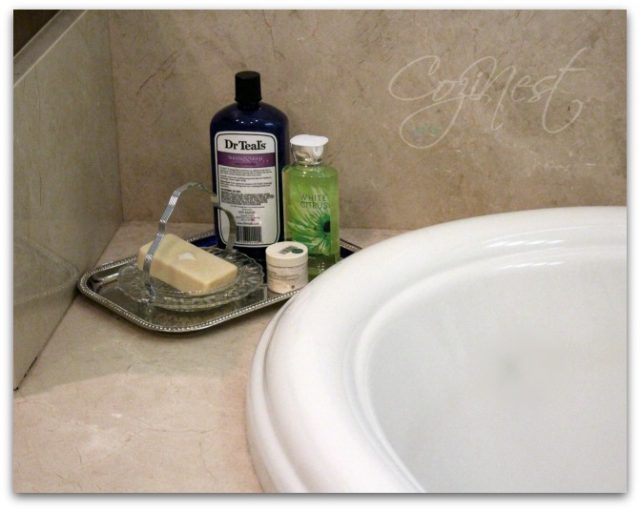
The height and width of the screenshot is (510, 640). Identify the location of bottle. (294, 280).